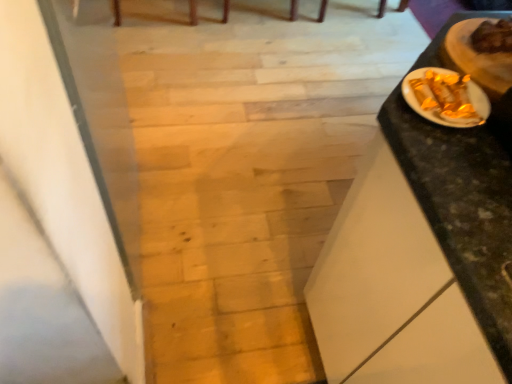
Question: From the image's perspective, is gold foil wrapped food at right under gold foil candy at right, the first food from the bottom?

Choices:
 (A) no
 (B) yes

Answer: (A)

Question: From a real-world perspective, is gold foil wrapped food at right on top of gold foil candy at right, which is counted as the 2th food, starting from the right?

Choices:
 (A) no
 (B) yes

Answer: (A)

Question: Is the position of gold foil wrapped food at right more distant than that of gold foil candy at right, marked as the 2th food in a top-to-bottom arrangement?

Choices:
 (A) yes
 (B) no

Answer: (A)

Question: Could you tell me if gold foil wrapped food at right is facing gold foil candy at right, which is counted as the 2th food, starting from the right?

Choices:
 (A) yes
 (B) no

Answer: (B)

Question: Does gold foil wrapped food at right appear on the left side of gold foil candy at right, marked as the 2th food in a top-to-bottom arrangement?

Choices:
 (A) no
 (B) yes

Answer: (A)

Question: Based on their positions, is golden foil-wrapped food at upper right, the second food positioned from the left, located to the left or right of gold foil wrapped food at right?

Choices:
 (A) right
 (B) left

Answer: (B)

Question: Would you say golden foil-wrapped food at upper right, acting as the first food starting from the top, is inside or outside gold foil wrapped food at right?

Choices:
 (A) inside
 (B) outside

Answer: (B)

Question: From a real-world perspective, is golden foil-wrapped food at upper right, the second food positioned from the left, physically located above or below gold foil wrapped food at right?

Choices:
 (A) above
 (B) below

Answer: (A)

Question: Is golden foil-wrapped food at upper right, which is counted as the 1th food, starting from the right, taller or shorter than gold foil wrapped food at right?

Choices:
 (A) short
 (B) tall

Answer: (B)

Question: Considering the positions of gold foil candy at right, the first food from the bottom, and gold foil wrapped food at right in the image, is gold foil candy at right, the first food from the bottom, taller or shorter than gold foil wrapped food at right?

Choices:
 (A) short
 (B) tall

Answer: (A)

Question: In the image, is gold foil candy at right, the first food from the bottom, positioned in front of or behind gold foil wrapped food at right?

Choices:
 (A) front
 (B) behind

Answer: (A)

Question: In terms of width, does gold foil candy at right, which is counted as the 2th food, starting from the right, look wider or thinner when compared to gold foil wrapped food at right?

Choices:
 (A) wide
 (B) thin

Answer: (B)

Question: From a real-world perspective, is gold foil candy at right, the first food from the bottom, above or below gold foil wrapped food at right?

Choices:
 (A) above
 (B) below

Answer: (A)

Question: Considering their positions, is black marble table at right located in front of or behind gold foil wrapped food at right?

Choices:
 (A) behind
 (B) front

Answer: (B)

Question: In the image, is black marble table at right on the left side or the right side of gold foil wrapped food at right?

Choices:
 (A) left
 (B) right

Answer: (B)